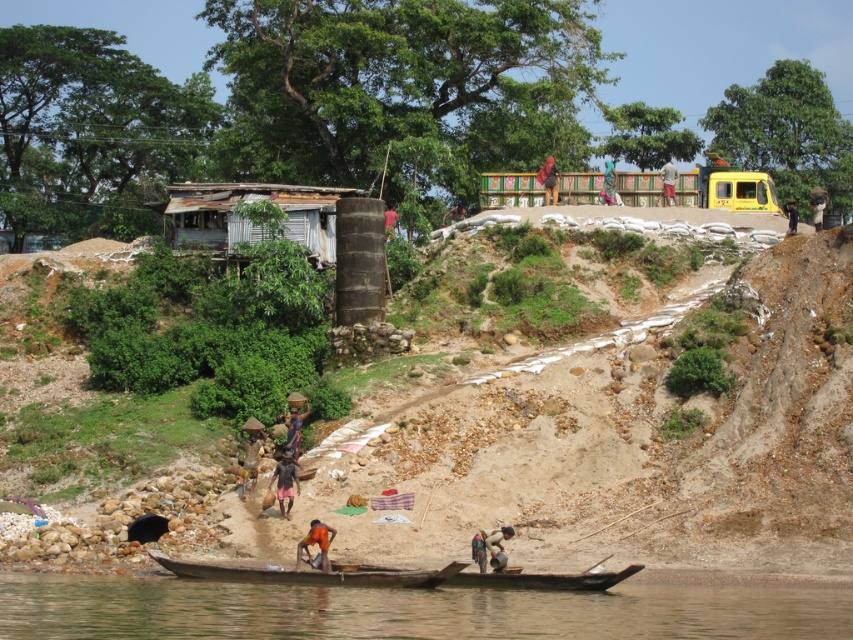
Which is behind, point (547, 204) or point (387, 216)?

The point (547, 204) is more distant.

Locate an element on the screen. Image resolution: width=853 pixels, height=640 pixels. multicolored fabric at upper center is located at coordinates (550, 180).

Does wooden boat at lower center have a lesser height compared to dark brown skin at center?

Indeed, wooden boat at lower center has a lesser height compared to dark brown skin at center.

Does wooden boat at lower center have a greater width compared to dark brown skin at center?

Indeed, wooden boat at lower center has a greater width compared to dark brown skin at center.

Is point (241, 570) closer to viewer compared to point (276, 480)?

Yes.

Locate an element on the screen. The image size is (853, 640). wooden boat at lower center is located at coordinates (398, 576).

Between rusty wood hut at center-left and light brown wooden pole at upper center, which one is positioned higher?

Positioned higher is light brown wooden pole at upper center.

Consider the image. Does rusty wood hut at center-left have a larger size compared to light brown wooden pole at upper center?

Correct, rusty wood hut at center-left is larger in size than light brown wooden pole at upper center.

Identify the location of rusty wood hut at center-left. (251, 220).

At what (x,y) coordinates should I click in order to perform the action: click on rusty wood hut at center-left. Please return your answer as a coordinate pair (x, y). Image resolution: width=853 pixels, height=640 pixels. Looking at the image, I should click on pos(251,220).